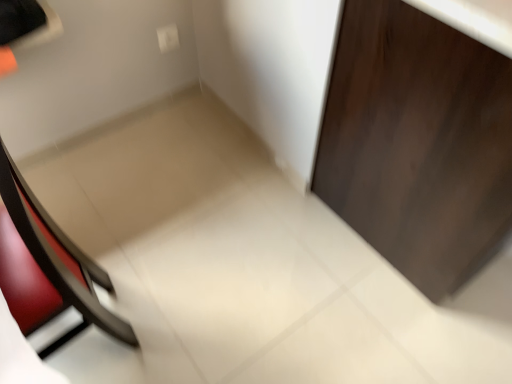
Question: Does white plastic electric outlet at upper center have a smaller size compared to dark wood door at right?

Choices:
 (A) yes
 (B) no

Answer: (A)

Question: Considering the relative sizes of white plastic electric outlet at upper center and dark wood door at right in the image provided, is white plastic electric outlet at upper center thinner than dark wood door at right?

Choices:
 (A) no
 (B) yes

Answer: (B)

Question: Considering the relative positions of white plastic electric outlet at upper center and dark wood door at right in the image provided, is white plastic electric outlet at upper center in front of dark wood door at right?

Choices:
 (A) no
 (B) yes

Answer: (A)

Question: Would you say white plastic electric outlet at upper center is a long distance from dark wood door at right?

Choices:
 (A) yes
 (B) no

Answer: (A)

Question: Does white plastic electric outlet at upper center appear on the left side of dark wood door at right?

Choices:
 (A) yes
 (B) no

Answer: (A)

Question: From the image's perspective, would you say white plastic electric outlet at upper center is shown under dark wood door at right?

Choices:
 (A) yes
 (B) no

Answer: (B)

Question: Does dark wood door at right have a greater width compared to matte black chair at left?

Choices:
 (A) no
 (B) yes

Answer: (B)

Question: From a real-world perspective, is dark wood door at right physically below matte black chair at left?

Choices:
 (A) yes
 (B) no

Answer: (A)

Question: Is the position of dark wood door at right less distant than that of matte black chair at left?

Choices:
 (A) no
 (B) yes

Answer: (A)

Question: Considering the relative positions of dark wood door at right and matte black chair at left in the image provided, is dark wood door at right behind matte black chair at left?

Choices:
 (A) no
 (B) yes

Answer: (B)

Question: Can you confirm if dark wood door at right is positioned to the right of matte black chair at left?

Choices:
 (A) no
 (B) yes

Answer: (B)

Question: Is dark wood door at right looking in the opposite direction of matte black chair at left?

Choices:
 (A) no
 (B) yes

Answer: (A)

Question: Considering the relative sizes of matte black chair at left and white plastic electric outlet at upper center in the image provided, is matte black chair at left smaller than white plastic electric outlet at upper center?

Choices:
 (A) no
 (B) yes

Answer: (A)